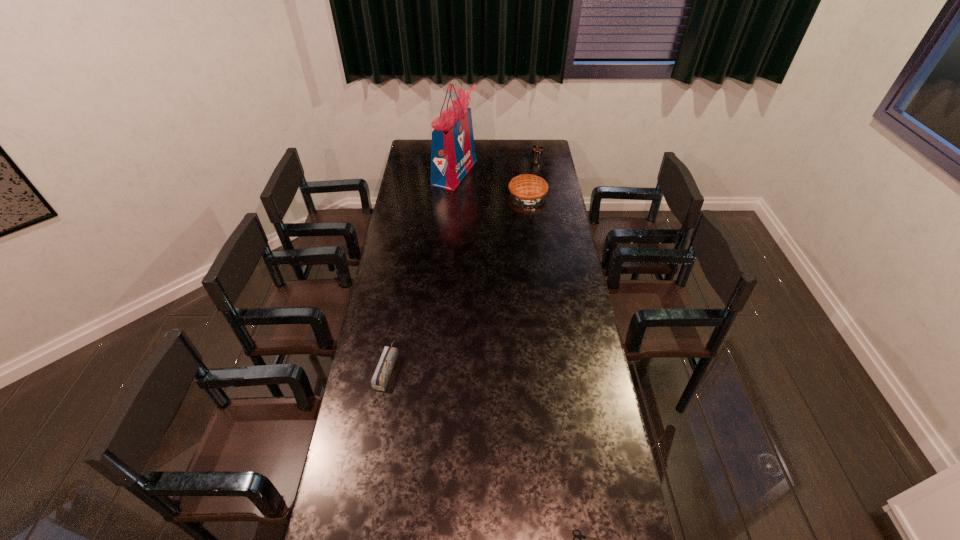
This screenshot has width=960, height=540. What are the coordinates of `the tallest object` in the screenshot? It's located at (452, 150).

Where is `grocery bag`? The image size is (960, 540). grocery bag is located at coordinates (452, 150).

At what (x,y) coordinates should I click in order to perform the action: click on can. Please return your answer as a coordinate pair (x, y). This screenshot has width=960, height=540. Looking at the image, I should click on (537, 151).

The width and height of the screenshot is (960, 540). What are the coordinates of `the third tallest object` in the screenshot? It's located at (529, 189).

Where is `the leftmost object`? This screenshot has height=540, width=960. the leftmost object is located at coordinates (379, 381).

I want to click on the fourth farthest object, so click(x=379, y=381).

Identify the location of vacant space located 0.060m on the front-facing side of the grocery bag. (488, 172).

Locate an element on the screen. free location located on the front of the second tallest object is located at coordinates (539, 175).

Find the location of a particular element. The width and height of the screenshot is (960, 540). vacant region located on the back of the third tallest object is located at coordinates (524, 161).

Where is `vacant region located on the right of the leftmost object`? This screenshot has height=540, width=960. vacant region located on the right of the leftmost object is located at coordinates (502, 367).